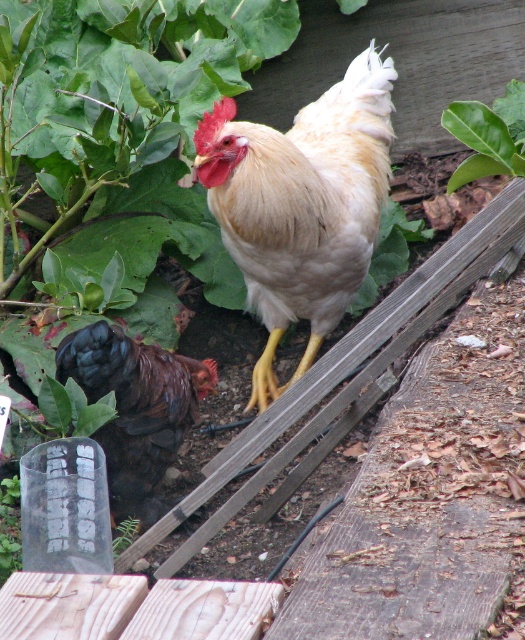
You are a farmer checking your chickens in the garden. You notice a golden feathered rooster at center and a dark brown feathers at center. Which chicken is more to the right?

The golden feathered rooster at center is more to the right because it is positioned on the right side of dark brown feathers at center.

You are a gardener standing at point (301, 204) in the garden. You see a golden feathered rooster at center. Can you tell me what is located at your current position?

At point (301, 204) lies golden feathered rooster at center.

You are a gardener who wants to place a new plant pot between the golden feathered rooster at center and the green leafy at upper center. Based on their positions, where should the pot be placed?

The golden feathered rooster at center is located below the green leafy at upper center, so the new plant pot should be placed between them in the middle area between the rooster and the leaves.